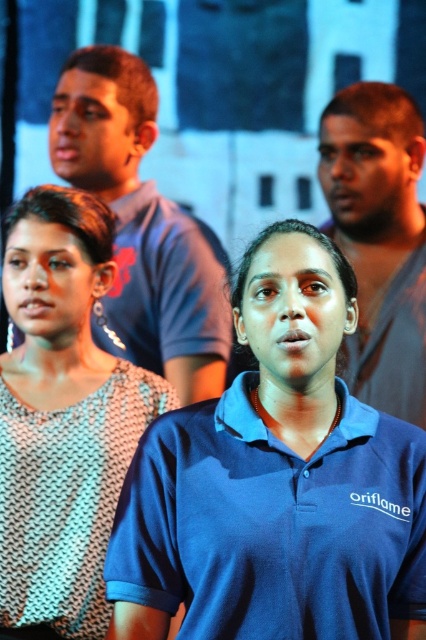
You are a photographer standing in front of the stage. You need to take a photo of both the matte blue shirt at upper center and the matte gray shirt at center. Which one is closer to you?

The matte blue shirt at upper center is closer to the viewer than the matte gray shirt at center.

You are a photographer trying to capture a group photo of the knitted fabric top at center and the matte gray shirt at center. Which one should you focus on first if you want to ensure both are in the frame?

You should focus on the knitted fabric top at center first because it is positioned to the left of the matte gray shirt at center, so adjusting the frame to include the leftmost subject ensures the rightmost is also captured.